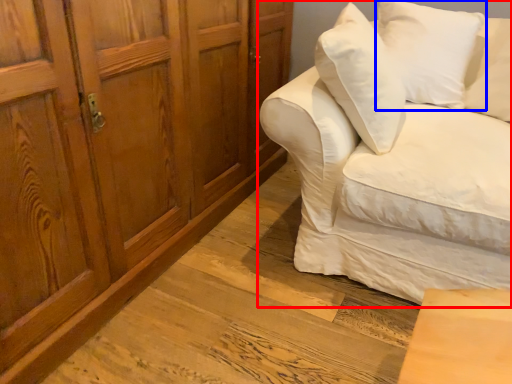
Question: Which of the following is the closest to the observer, studio couch (highlighted by a red box) or pillow (highlighted by a blue box)?

Choices:
 (A) studio couch
 (B) pillow

Answer: (A)